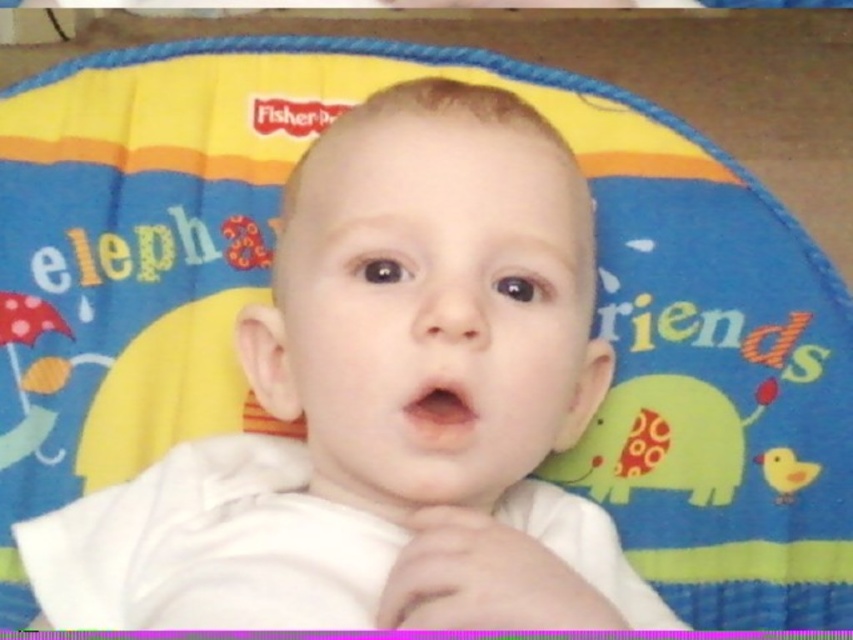
Which is behind, point (273, 496) or point (819, 472)?

Positioned behind is point (819, 472).

Can you confirm if white soft baby at center is positioned to the right of yellow matte duckling at lower right?

Incorrect, white soft baby at center is not on the right side of yellow matte duckling at lower right.

Who is more forward, (293, 620) or (813, 472)?

Positioned in front is point (293, 620).

Identify the location of white soft baby at center. This screenshot has height=640, width=853. (386, 404).